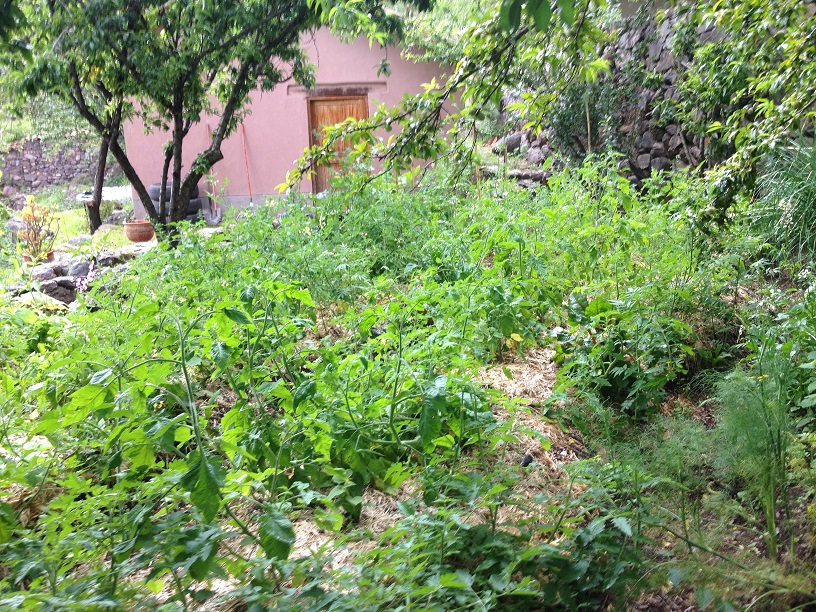
At what (x,y) coordinates should I click in order to perform the action: click on area atop the door. Please return your answer as a coordinate pair (x, y). Looking at the image, I should click on coord(331,84).